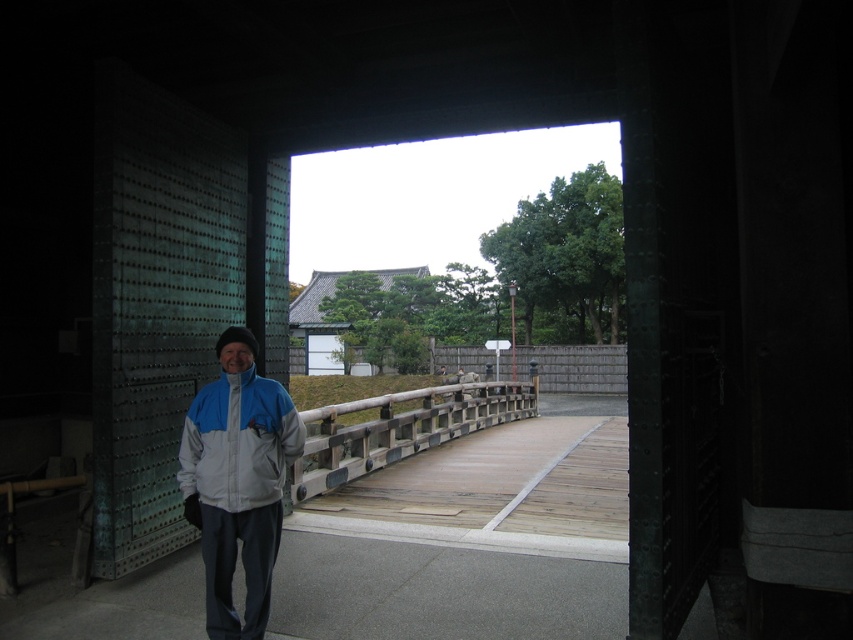
Question: Which object appears farthest from the camera in this image?

Choices:
 (A) wooden textured rail at center
 (B) light blue fabric jacket at center
 (C) wooden bridge at center

Answer: (A)

Question: Which point is closer to the camera?

Choices:
 (A) light blue fabric jacket at center
 (B) wooden bridge at center
 (C) blue-gray fabric jacket at left
 (D) wooden textured rail at center

Answer: (C)

Question: Which point appears closest to the camera in this image?

Choices:
 (A) (422, 456)
 (B) (537, 378)

Answer: (A)

Question: Is wooden bridge at center closer to camera compared to blue-gray fabric jacket at left?

Choices:
 (A) yes
 (B) no

Answer: (B)

Question: Is light blue fabric jacket at center above wooden textured rail at center?

Choices:
 (A) yes
 (B) no

Answer: (A)

Question: Is light blue fabric jacket at center above wooden textured rail at center?

Choices:
 (A) yes
 (B) no

Answer: (A)